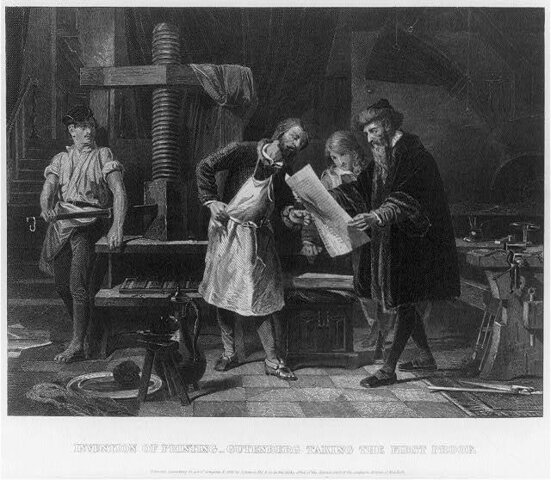
You are a GUI agent. You are given a task and a screenshot of the screen. Output one action in this format:
    pyautogui.click(x=<x>, y=<y>)
    Task: Click on the coat
    
    Given the screenshot: What is the action you would take?
    [418, 194]